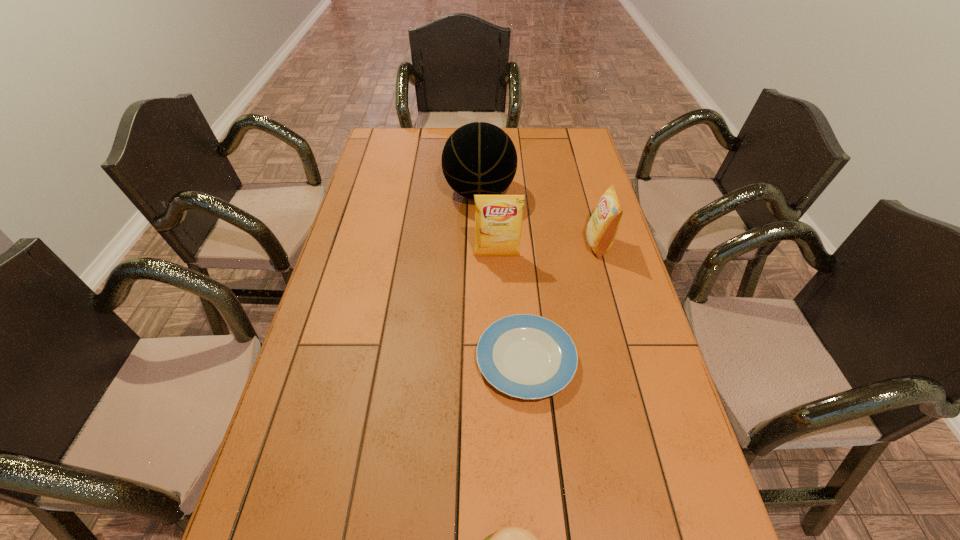
You are a GUI agent. You are given a task and a screenshot of the screen. Output one action in this format:
    pyautogui.click(x=<x>, y=<y>)
    Task: Click on the vacant space that is in between the plate and the farthest object
    
    Given the screenshot: What is the action you would take?
    pyautogui.click(x=503, y=276)

Where is `unoccupied area between the farthest object and the plate`? Image resolution: width=960 pixels, height=540 pixels. unoccupied area between the farthest object and the plate is located at coordinates (503, 276).

Where is `object that is the nearest to the hamburger`? object that is the nearest to the hamburger is located at coordinates pyautogui.click(x=525, y=356).

Identify which object is located as the second nearest to the hamburger. Please provide its 2D coordinates. Your answer should be formatted as a tuple, i.e. [(x, y)], where the tuple contains the x and y coordinates of a point satisfying the conditions above.

[(498, 219)]

Locate an element on the screen. vacant space that satisfies the following two spatial constraints: 1. on the front-facing side of the third shortest object; 2. on the front of the left crisp (potato chip) with the logo is located at coordinates (602, 256).

Find the location of a particular element. The height and width of the screenshot is (540, 960). free point that satisfies the following two spatial constraints: 1. on the front-facing side of the right crisp (potato chip); 2. on the front of the left crisp (potato chip) with the logo is located at coordinates pyautogui.click(x=602, y=256).